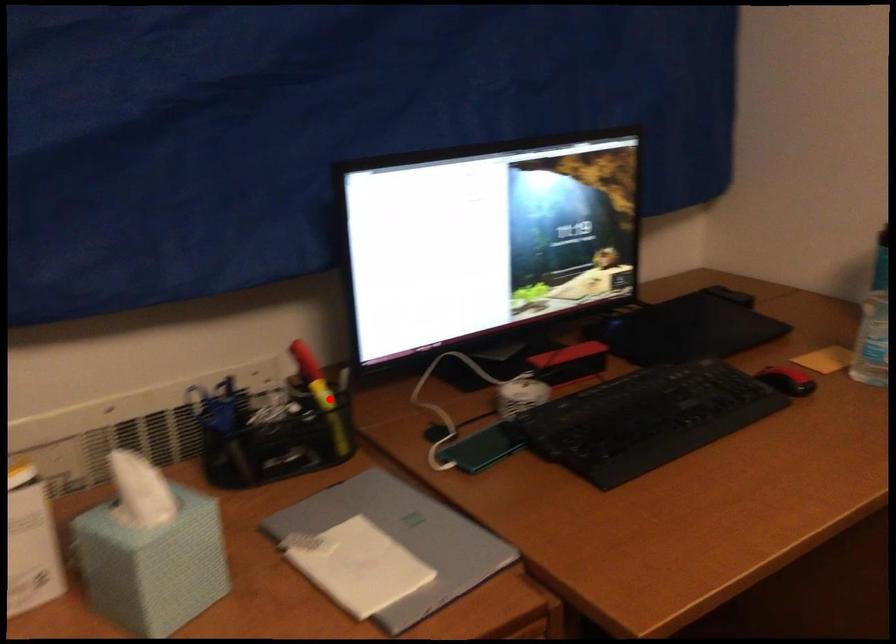
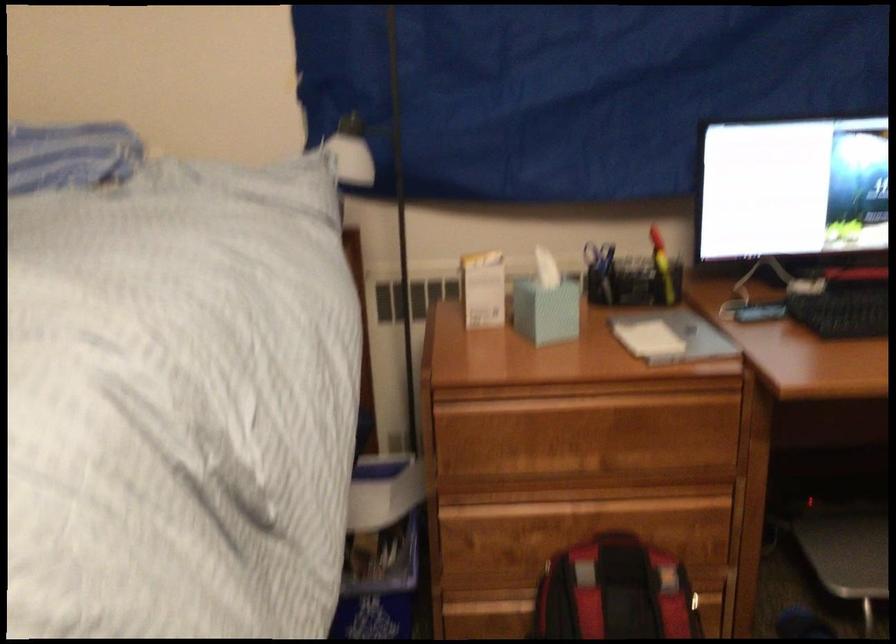
The point at the highlighted location is marked in the first image. Where is the corresponding point in the second image?

(662, 267)